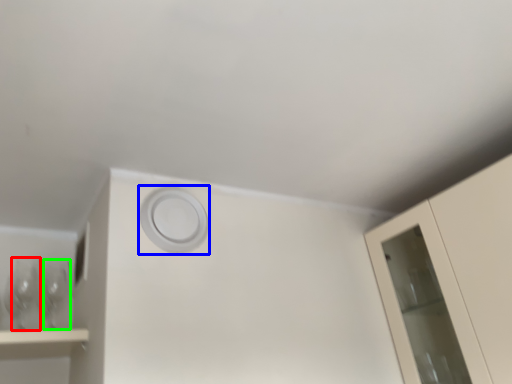
Question: Which object is the closest to the wine glass (highlighted by a red box)? Choose among these: circle (highlighted by a blue box) or wine glass (highlighted by a green box).

Choices:
 (A) circle
 (B) wine glass

Answer: (B)